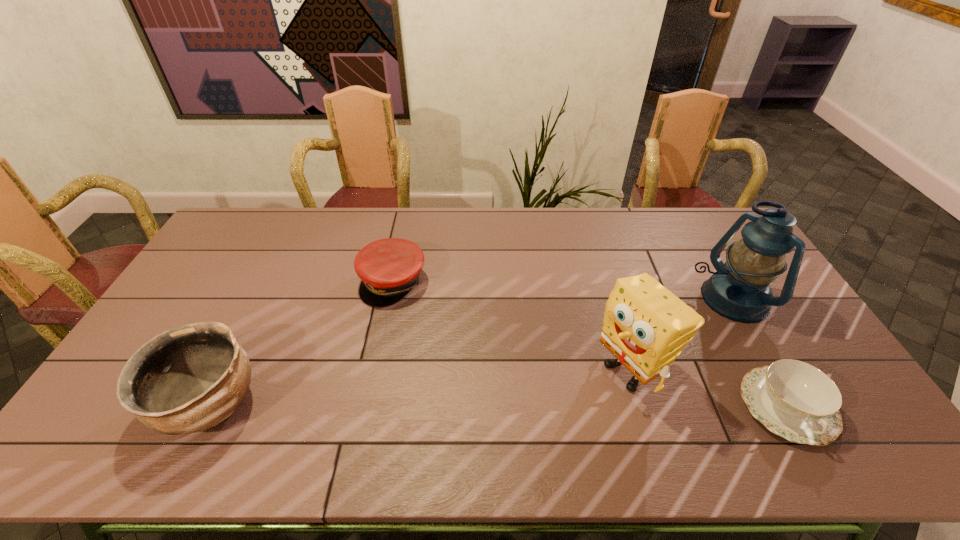
Find the location of a particular element. free spot on the desktop that is between the pottery and the shortest object and is positioned on the front-facing side of the cap is located at coordinates (439, 405).

Image resolution: width=960 pixels, height=540 pixels. Find the location of `free spot on the desktop that is between the pottery and the chinaware and is positioned on the face of the third object from left to right`. free spot on the desktop that is between the pottery and the chinaware and is positioned on the face of the third object from left to right is located at coordinates (567, 406).

Locate an element on the screen. This screenshot has width=960, height=540. free spot on the desktop that is between the third shortest object and the chinaware and is positioned on the face of the tallest object is located at coordinates (540, 406).